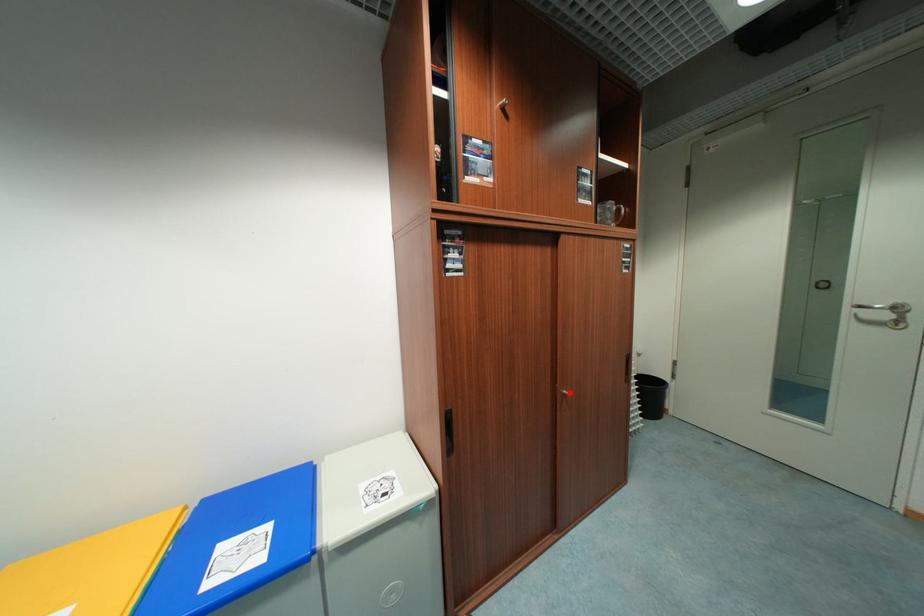
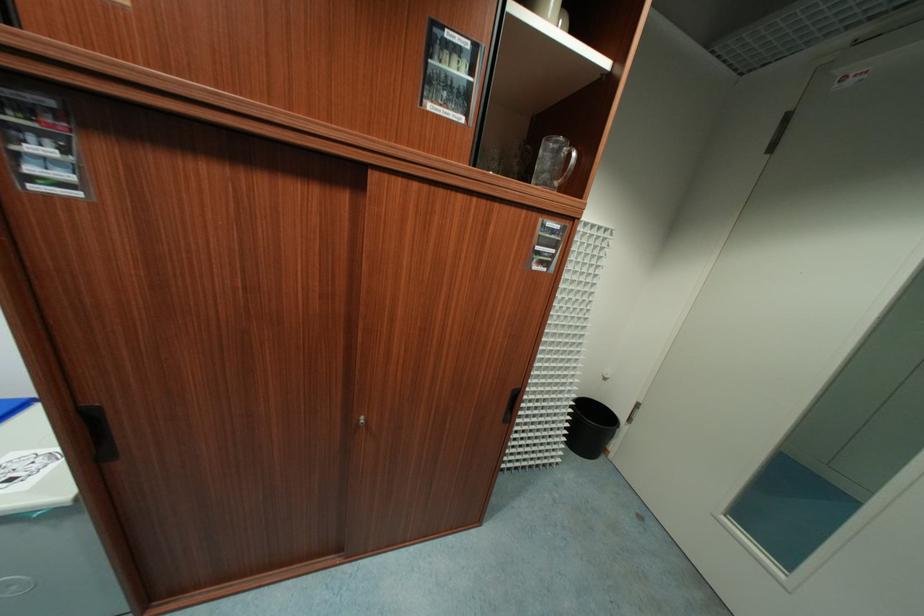
Where in the second image is the point corresponding to the highlighted location from the first image?

(368, 419)